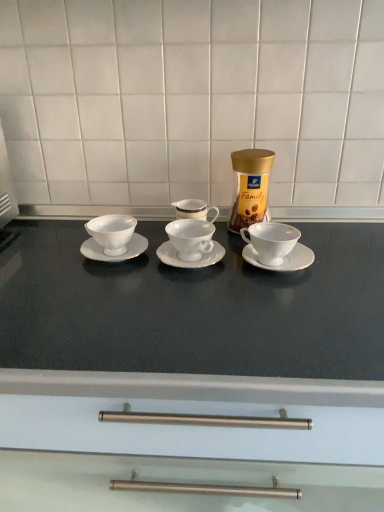
What do you see at coordinates (271, 241) in the screenshot?
I see `white porcelain cup at right, marked as the 3th coffee cup in a left-to-right arrangement` at bounding box center [271, 241].

Where is `gold metallic jar at center`? Image resolution: width=384 pixels, height=512 pixels. gold metallic jar at center is located at coordinates (250, 187).

From the image's perspective, is white porcelain saucer at left, the third saucer from the right, above white porcelain saucer at center, which ranks as the second saucer in left-to-right order?

Yes.

Would you say white porcelain saucer at left, the 1th saucer in the left-to-right sequence, is a long distance from white porcelain saucer at center, marked as the 2th saucer in a right-to-left arrangement?

white porcelain saucer at left, the 1th saucer in the left-to-right sequence, is actually quite close to white porcelain saucer at center, marked as the 2th saucer in a right-to-left arrangement.

Is white porcelain saucer at left, the 1th saucer in the left-to-right sequence, not inside white porcelain saucer at center, which ranks as the second saucer in left-to-right order?

Absolutely, white porcelain saucer at left, the 1th saucer in the left-to-right sequence, is external to white porcelain saucer at center, which ranks as the second saucer in left-to-right order.

Is matte white countertop at center facing away from white ceramic saucer at right, marked as the 3th saucer in a left-to-right arrangement?

No, white ceramic saucer at right, marked as the 3th saucer in a left-to-right arrangement, is not at the back of matte white countertop at center.

From a real-world perspective, is matte white countertop at center positioned above or below white ceramic saucer at right, marked as the 3th saucer in a left-to-right arrangement?

matte white countertop at center is situated lower than white ceramic saucer at right, marked as the 3th saucer in a left-to-right arrangement, in the real world.

Is matte white countertop at center behind white ceramic saucer at right, positioned as the first saucer in right-to-left order?

No, matte white countertop at center is in front of white ceramic saucer at right, positioned as the first saucer in right-to-left order.

Are matte white countertop at center and white ceramic saucer at right, marked as the 3th saucer in a left-to-right arrangement, far apart?

That's not correct — matte white countertop at center is a little close to white ceramic saucer at right, marked as the 3th saucer in a left-to-right arrangement.

Find the location of a particular element. The height and width of the screenshot is (512, 384). countertop on the left of white porcelain cup at right, acting as the 1th coffee cup starting from the right is located at coordinates (190, 372).

Is matte white countertop at center touching white porcelain cup at right, acting as the 1th coffee cup starting from the right?

matte white countertop at center and white porcelain cup at right, acting as the 1th coffee cup starting from the right, are clearly separated.

Is matte white countertop at center positioned with its back to white porcelain cup at right, acting as the 1th coffee cup starting from the right?

No, matte white countertop at center is not facing away from white porcelain cup at right, acting as the 1th coffee cup starting from the right.

Which of these two, matte white countertop at center or white porcelain cup at right, marked as the 3th coffee cup in a left-to-right arrangement, is bigger?

matte white countertop at center is bigger.

How many degrees apart are the facing directions of white ceramic saucer at right, marked as the 3th saucer in a left-to-right arrangement, and white porcelain saucer at center, which ranks as the second saucer in left-to-right order?

0.000147 degrees separate the facing orientations of white ceramic saucer at right, marked as the 3th saucer in a left-to-right arrangement, and white porcelain saucer at center, which ranks as the second saucer in left-to-right order.

In terms of width, does white ceramic saucer at right, positioned as the first saucer in right-to-left order, look wider or thinner when compared to white porcelain saucer at center, which ranks as the second saucer in left-to-right order?

Clearly, white ceramic saucer at right, positioned as the first saucer in right-to-left order, has less width compared to white porcelain saucer at center, which ranks as the second saucer in left-to-right order.

Is white ceramic saucer at right, marked as the 3th saucer in a left-to-right arrangement, shorter than white porcelain saucer at center, marked as the 2th saucer in a right-to-left arrangement?

Yes, white ceramic saucer at right, marked as the 3th saucer in a left-to-right arrangement, is shorter than white porcelain saucer at center, marked as the 2th saucer in a right-to-left arrangement.

From a real-world perspective, is white porcelain saucer at center, which ranks as the second saucer in left-to-right order, over gold metallic jar at center?

Actually, white porcelain saucer at center, which ranks as the second saucer in left-to-right order, is physically below gold metallic jar at center in the real world.

Which of these two, white porcelain saucer at center, marked as the 2th saucer in a right-to-left arrangement, or gold metallic jar at center, stands shorter?

Standing shorter between the two is white porcelain saucer at center, marked as the 2th saucer in a right-to-left arrangement.

In terms of width, does white porcelain saucer at center, marked as the 2th saucer in a right-to-left arrangement, look wider or thinner when compared to gold metallic jar at center?

white porcelain saucer at center, marked as the 2th saucer in a right-to-left arrangement, is wider than gold metallic jar at center.

Considering the points (170, 244) and (262, 203), which point is in front, point (170, 244) or point (262, 203)?

Positioned in front is point (170, 244).

Which object is positioned more to the right, gold metallic jar at center or matte white countertop at center?

gold metallic jar at center.

From the image's perspective, which object appears higher, gold metallic jar at center or matte white countertop at center?

gold metallic jar at center.

From a real-world perspective, does gold metallic jar at center stand above matte white countertop at center?

Correct, in the physical world, gold metallic jar at center is higher than matte white countertop at center.

Would you say gold metallic jar at center is a long distance from matte white countertop at center?

That's not correct — gold metallic jar at center is a little close to matte white countertop at center.

Is white porcelain cup at center, which is the 2th coffee cup from left to right, outside of white porcelain saucer at center, which ranks as the second saucer in left-to-right order?

Actually, white porcelain cup at center, which is the 2th coffee cup from left to right, is within white porcelain saucer at center, which ranks as the second saucer in left-to-right order.

Is white porcelain cup at center, which is the 2th coffee cup from left to right, far from white porcelain saucer at center, which ranks as the second saucer in left-to-right order?

white porcelain cup at center, which is the 2th coffee cup from left to right, is actually quite close to white porcelain saucer at center, which ranks as the second saucer in left-to-right order.

At what (x,y) coordinates should I click in order to perform the action: click on coffee cup that is the 2nd object above the white porcelain saucer at center, marked as the 2th saucer in a right-to-left arrangement (from a real-world perspective). Please return your answer as a coordinate pair (x, y). Image resolution: width=384 pixels, height=512 pixels. Looking at the image, I should click on (191, 238).

Considering the positions of objects white porcelain cup at center, the second coffee cup when ordered from right to left, and white porcelain saucer at center, marked as the 2th saucer in a right-to-left arrangement, in the image provided, who is more to the left, white porcelain cup at center, the second coffee cup when ordered from right to left, or white porcelain saucer at center, marked as the 2th saucer in a right-to-left arrangement,?

Positioned to the left is white porcelain cup at center, the second coffee cup when ordered from right to left.

The image size is (384, 512). In order to click on saucer behind the white porcelain saucer at center, marked as the 2th saucer in a right-to-left arrangement in this screenshot , I will do `click(114, 256)`.

Where is `countertop that appears below the white ceramic saucer at right, positioned as the first saucer in right-to-left order (from a real-world perspective)`? Image resolution: width=384 pixels, height=512 pixels. countertop that appears below the white ceramic saucer at right, positioned as the first saucer in right-to-left order (from a real-world perspective) is located at coordinates (190, 372).

From the image, which object appears to be nearer to gold metallic jar at center, white porcelain saucer at left, the 1th saucer in the left-to-right sequence, or white ceramic saucer at right, marked as the 3th saucer in a left-to-right arrangement?

white ceramic saucer at right, marked as the 3th saucer in a left-to-right arrangement, lies closer to gold metallic jar at center than the other object.

When comparing their distances from white porcelain cup at right, acting as the 1th coffee cup starting from the right, does white porcelain cup at center, which is the 2th coffee cup from left to right, or gold metallic jar at center seem further?

Among the two, white porcelain cup at center, which is the 2th coffee cup from left to right, is located further to white porcelain cup at right, acting as the 1th coffee cup starting from the right.

Based on their spatial positions, is white porcelain saucer at left, the third saucer from the right, or white porcelain saucer at center, which ranks as the second saucer in left-to-right order, closer to matte white countertop at center?

Based on the image, white porcelain saucer at center, which ranks as the second saucer in left-to-right order, appears to be nearer to matte white countertop at center.

In the scene shown: When comparing their distances from white porcelain saucer at left, the third saucer from the right, does gold metallic jar at center or matte white countertop at center seem closer?

gold metallic jar at center is closer to white porcelain saucer at left, the third saucer from the right.

Considering their positions, is white porcelain saucer at left, the 1th saucer in the left-to-right sequence, positioned further to gold metallic jar at center than white porcelain saucer at center, which ranks as the second saucer in left-to-right order?

white porcelain saucer at left, the 1th saucer in the left-to-right sequence, is positioned further to the anchor gold metallic jar at center.

Which object lies further to the anchor point white ceramic saucer at right, positioned as the first saucer in right-to-left order, white porcelain cup at right, acting as the 1th coffee cup starting from the right, or white porcelain cup at center, the second coffee cup when ordered from right to left?

white porcelain cup at center, the second coffee cup when ordered from right to left, is positioned further to the anchor white ceramic saucer at right, positioned as the first saucer in right-to-left order.

Consider the image. Considering their positions, is white porcelain saucer at left, the third saucer from the right, positioned closer to white porcelain cup at left, marked as the 3th coffee cup in a right-to-left arrangement, than white porcelain saucer at center, marked as the 2th saucer in a right-to-left arrangement?

white porcelain saucer at left, the third saucer from the right, is closer to white porcelain cup at left, marked as the 3th coffee cup in a right-to-left arrangement.

Looking at the image, which one is located further to white porcelain cup at center, which is the 2th coffee cup from left to right, gold metallic jar at center or white porcelain saucer at center, marked as the 2th saucer in a right-to-left arrangement?

The object further to white porcelain cup at center, which is the 2th coffee cup from left to right, is gold metallic jar at center.

The height and width of the screenshot is (512, 384). Identify the location of saucer between white porcelain saucer at left, the 1th saucer in the left-to-right sequence, and white porcelain cup at right, acting as the 1th coffee cup starting from the right. (193, 255).

Where is `saucer between white porcelain cup at center, the second coffee cup when ordered from right to left, and white ceramic saucer at right, positioned as the first saucer in right-to-left order`? The height and width of the screenshot is (512, 384). saucer between white porcelain cup at center, the second coffee cup when ordered from right to left, and white ceramic saucer at right, positioned as the first saucer in right-to-left order is located at coordinates (193, 255).

This screenshot has width=384, height=512. In order to click on saucer between white porcelain saucer at left, the third saucer from the right, and gold metallic jar at center, in the horizontal direction in this screenshot , I will do `click(193, 255)`.

This screenshot has height=512, width=384. In order to click on saucer between white porcelain saucer at center, which ranks as the second saucer in left-to-right order, and matte white countertop at center, in the vertical direction in this screenshot , I will do `click(283, 259)`.